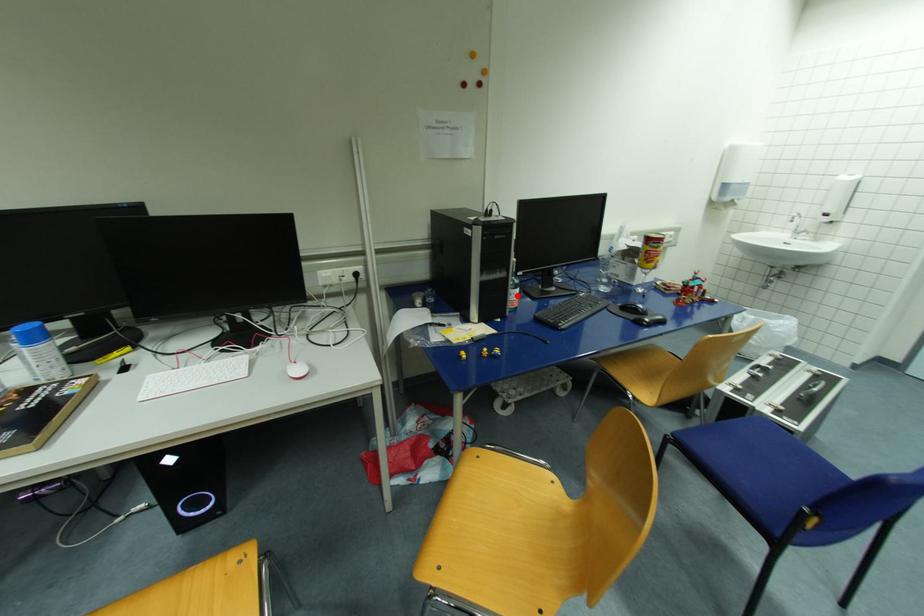
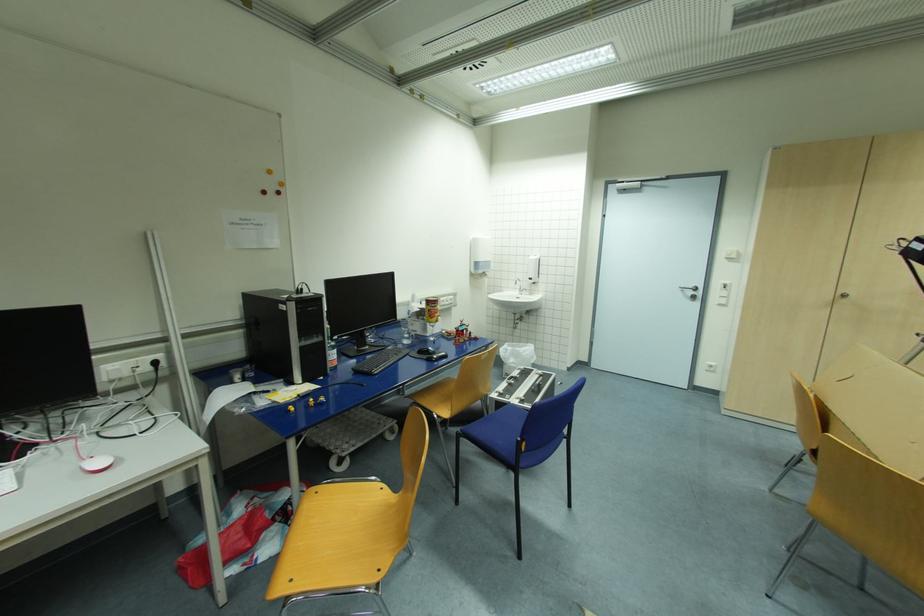
Where in the second image is the point corresponding to the highlighted location from the first image?

(335, 355)